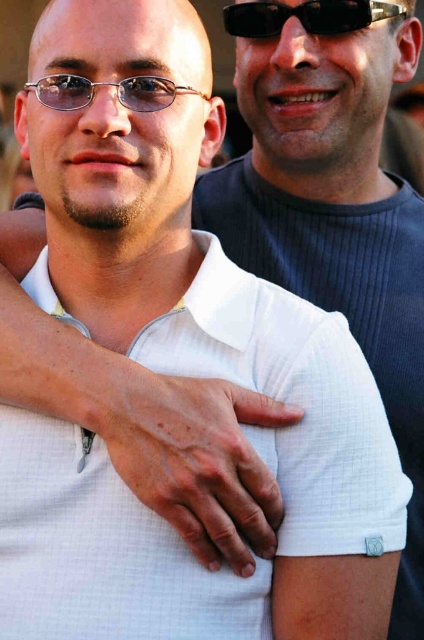
This screenshot has width=424, height=640. Describe the element at coordinates (306, 17) in the screenshot. I see `black plastic sunglasses at upper center` at that location.

Describe the element at coordinates (306, 17) in the screenshot. The height and width of the screenshot is (640, 424). I see `black plastic sunglasses at upper center` at that location.

Where is `black plastic sunglasses at upper center`? Image resolution: width=424 pixels, height=640 pixels. black plastic sunglasses at upper center is located at coordinates (306, 17).

Between white mesh shirt at center and black plastic sunglasses at upper center, which one appears on the right side from the viewer's perspective?

black plastic sunglasses at upper center

Does point (131, 387) lie in front of point (276, 29)?

Yes, point (131, 387) is in front of point (276, 29).

The width and height of the screenshot is (424, 640). Find the location of `white mesh shirt at center`. white mesh shirt at center is located at coordinates (153, 429).

This screenshot has height=640, width=424. Find the location of `white mesh shirt at center`. white mesh shirt at center is located at coordinates (153, 429).

This screenshot has width=424, height=640. Identify the location of white mesh shirt at center. (153, 429).

Who is positioned more to the left, white mesh shirt at center or matte metal glasses at center?

matte metal glasses at center

Is point (156, 419) positioned behind point (70, 100)?

No, (156, 419) is closer to viewer.

Find the location of `white mesh shirt at center`. white mesh shirt at center is located at coordinates (153, 429).